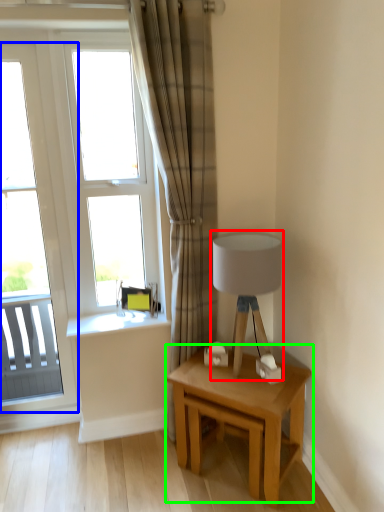
Question: Which object is the closest to the table lamp (highlighted by a red box)? Choose among these: window (highlighted by a blue box) or table (highlighted by a green box).

Choices:
 (A) window
 (B) table

Answer: (B)